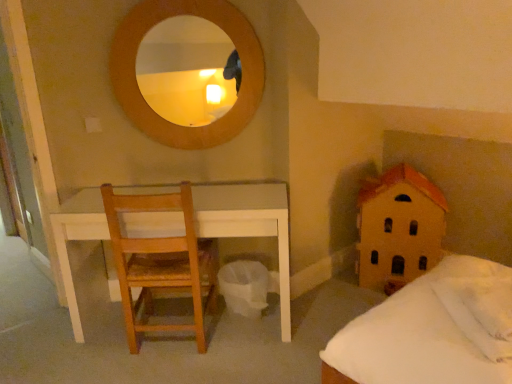
Image resolution: width=512 pixels, height=384 pixels. Identify the location of free region on the left part of light brown wooden chair at left. (94, 350).